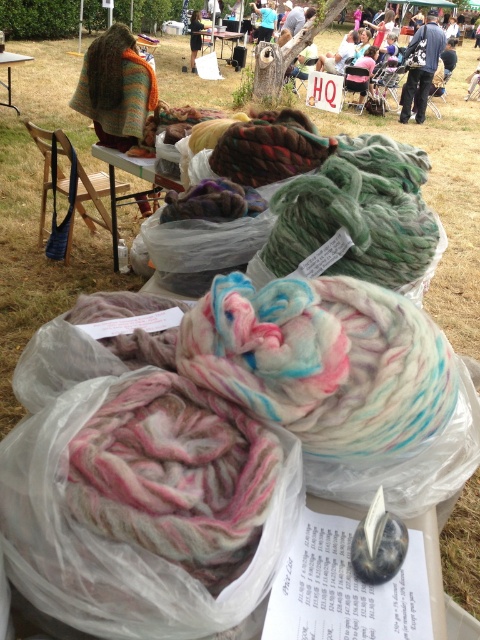
Question: Among these points, which one is farthest from the camera?

Choices:
 (A) (16, 56)
 (B) (110, 221)
 (C) (384, 252)

Answer: (A)

Question: Can you confirm if translucent plastic bags at center is wider than wooden table at center?

Choices:
 (A) yes
 (B) no

Answer: (B)

Question: Which object is farther from the camera taking this photo?

Choices:
 (A) translucent plastic bags at center
 (B) wooden table at center
 (C) white plastic table at upper left

Answer: (B)

Question: Is translucent plastic bags at center above wooden table at center?

Choices:
 (A) yes
 (B) no

Answer: (B)

Question: Does multicolored wool at center have a greater width compared to wooden table at center?

Choices:
 (A) yes
 (B) no

Answer: (B)

Question: Which point is closer to the camera?

Choices:
 (A) (x=336, y=182)
 (B) (x=149, y=157)
 (C) (x=242, y=40)
 (D) (x=6, y=60)

Answer: (A)